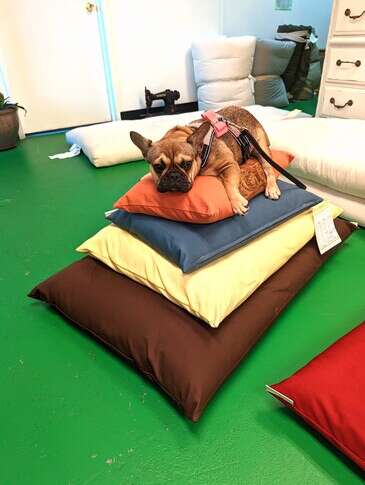
The height and width of the screenshot is (485, 365). In order to click on door in this screenshot , I will do `click(83, 49)`.